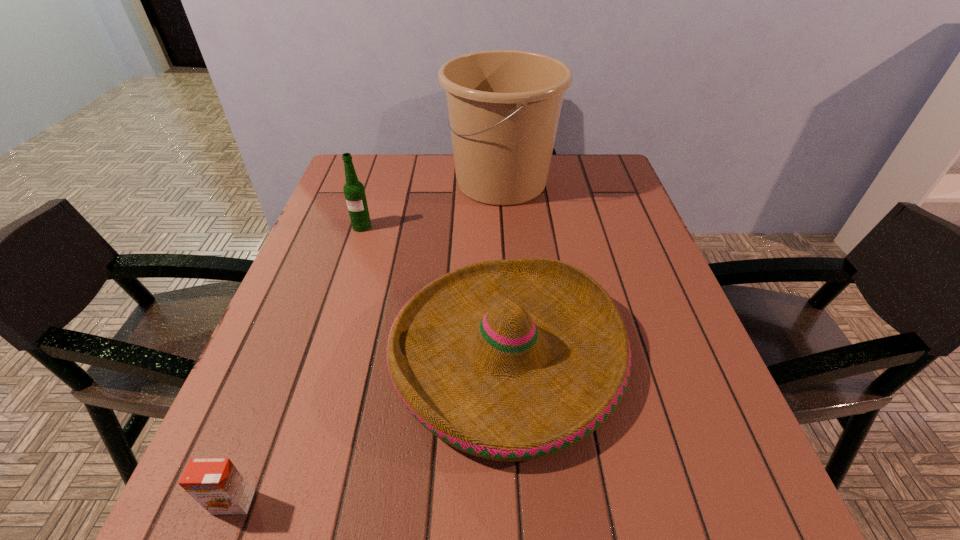
Find the location of a particular element. This screenshot has height=540, width=960. free space located 0.130m on the right of the second nearest object is located at coordinates (692, 353).

In order to click on free space located on the back of the shortest object in this screenshot , I will do `click(271, 406)`.

Find the location of a particular element. The width and height of the screenshot is (960, 540). object present at the far edge is located at coordinates (504, 106).

This screenshot has width=960, height=540. Find the location of `object located at the near edge`. object located at the near edge is located at coordinates (216, 484).

Find the location of `beer bottle positioned at the left edge`. beer bottle positioned at the left edge is located at coordinates (354, 191).

Locate an element on the screen. The image size is (960, 540). orange juice at the left edge is located at coordinates (216, 484).

This screenshot has width=960, height=540. What are the coordinates of `object situated at the right edge` in the screenshot? It's located at (511, 360).

Locate an element on the screen. The width and height of the screenshot is (960, 540). object at the near left corner is located at coordinates (216, 484).

In the image, there is a desktop. At what (x,y) coordinates should I click in order to perform the action: click on vacant region at the far edge. Please return your answer as a coordinate pair (x, y). Looking at the image, I should click on (431, 171).

Locate an element on the screen. Image resolution: width=960 pixels, height=540 pixels. vacant space at the near edge of the desktop is located at coordinates (372, 495).